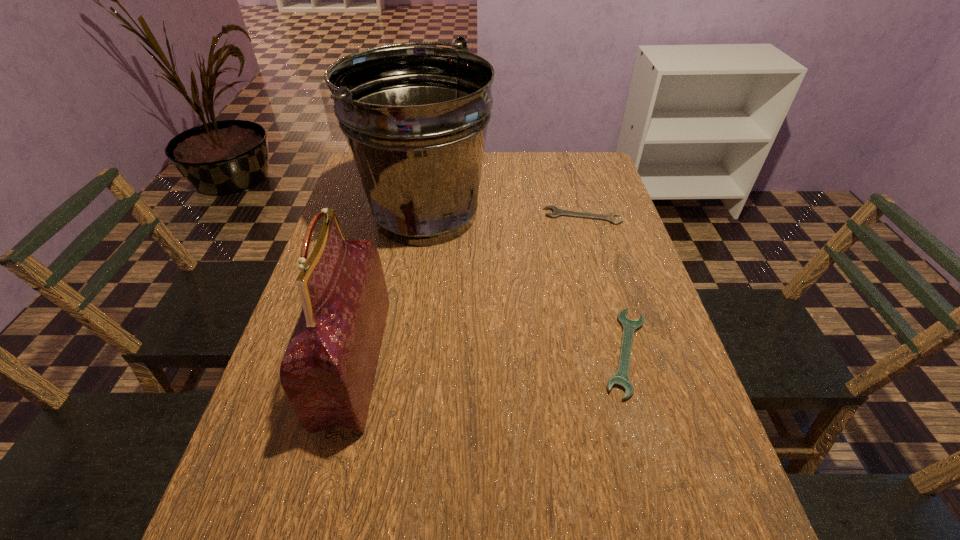
Where is `handbag at the left edge`? The height and width of the screenshot is (540, 960). handbag at the left edge is located at coordinates (328, 370).

Where is `object at the far left corner`? The width and height of the screenshot is (960, 540). object at the far left corner is located at coordinates (415, 118).

This screenshot has width=960, height=540. Find the location of `vacant space at the far edge of the desktop`. vacant space at the far edge of the desktop is located at coordinates (504, 173).

In the image, there is a desktop. Where is `free space at the left edge`? The image size is (960, 540). free space at the left edge is located at coordinates (352, 195).

This screenshot has height=540, width=960. In order to click on free spot at the right edge of the desktop in this screenshot , I will do `click(612, 249)`.

At what (x,y) coordinates should I click in order to perform the action: click on vacant point located between the bucket and the handbag. Please return your answer as a coordinate pair (x, y). Looking at the image, I should click on (390, 288).

I want to click on free space between the bucket and the third shortest object, so click(390, 288).

The width and height of the screenshot is (960, 540). In order to click on free space that is in between the tallest object and the nearer wrench in this screenshot , I will do `click(525, 284)`.

Find the location of a particular element. Image resolution: width=960 pixels, height=540 pixels. empty space that is in between the bucket and the second tallest object is located at coordinates (390, 288).

The width and height of the screenshot is (960, 540). What are the coordinates of `vacant region between the nearer wrench and the tallest object` in the screenshot? It's located at (525, 284).